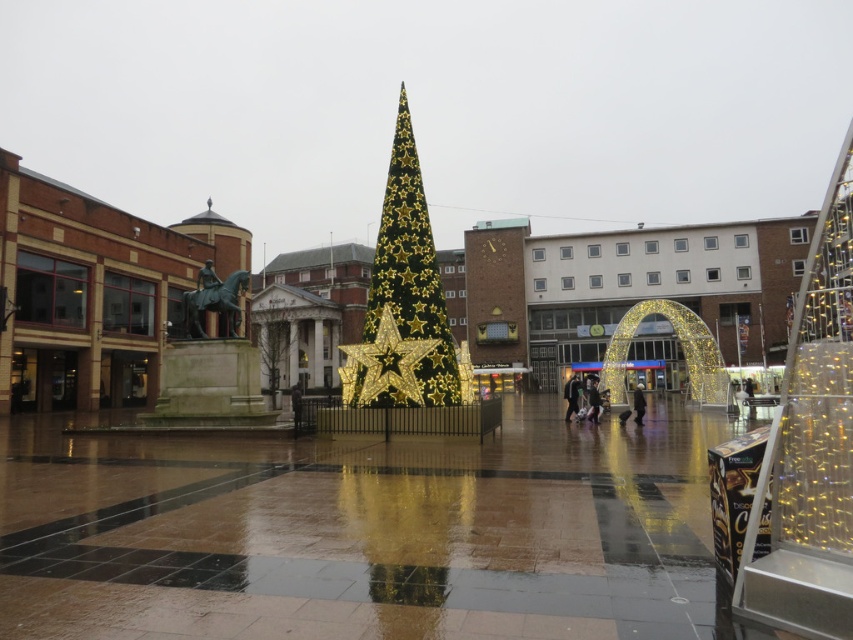
You are a delivery person standing at the dark brown leather jacket at lower right position. You need to deliver a package to the base of the green glittery christmas tree at center. Considering your cart is 3 feet wide, is there enough space to maneuver around the fence surrounding the tree?

The distance between the green glittery christmas tree at center and dark brown leather jacket at lower right is 77.04 feet. Since the cart is only 3 feet wide, there should be ample space to maneuver around the fence surrounding the tree.

You are a photographer standing in the public square and want to take a photo that includes both the gold metallic star at center and the matte black jacket at center. Which object will appear larger in the photo?

The gold metallic star at center will appear larger in the photo because it is much taller than the matte black jacket at center.

You are standing in the public square and want to take a photo of the green glittery christmas tree at center. According to the scene description, where should you position yourself to capture the tree in the center of your photo?

You should position yourself directly in front of the green glittery christmas tree at center, as it is located at the center of the square at coordinates point (404, 301). This central position will ensure the tree is centered in your photo.